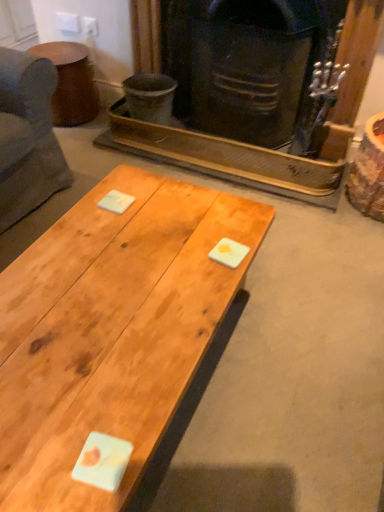
Question: Is natural wood coffee table at center positioned before brown matte side table at upper left?

Choices:
 (A) no
 (B) yes

Answer: (B)

Question: Considering the relative sizes of natural wood coffee table at center and brown matte side table at upper left in the image provided, is natural wood coffee table at center thinner than brown matte side table at upper left?

Choices:
 (A) yes
 (B) no

Answer: (B)

Question: Does natural wood coffee table at center have a greater width compared to brown matte side table at upper left?

Choices:
 (A) no
 (B) yes

Answer: (B)

Question: From a real-world perspective, is natural wood coffee table at center located beneath brown matte side table at upper left?

Choices:
 (A) yes
 (B) no

Answer: (B)

Question: Is natural wood coffee table at center far away from brown matte side table at upper left?

Choices:
 (A) yes
 (B) no

Answer: (A)

Question: Is point (66, 53) positioned closer to the camera than point (162, 129)?

Choices:
 (A) closer
 (B) farther

Answer: (B)

Question: From a real-world perspective, is brown matte side table at upper left physically located above or below dark brown wood fireplace at center?

Choices:
 (A) above
 (B) below

Answer: (B)

Question: Is brown matte side table at upper left spatially inside dark brown wood fireplace at center, or outside of it?

Choices:
 (A) outside
 (B) inside

Answer: (A)

Question: Is brown matte side table at upper left bigger or smaller than dark brown wood fireplace at center?

Choices:
 (A) small
 (B) big

Answer: (A)

Question: From the image's perspective, is dark brown wood fireplace at center above or below brown matte side table at upper left?

Choices:
 (A) below
 (B) above

Answer: (A)

Question: Is dark brown wood fireplace at center situated inside brown matte side table at upper left or outside?

Choices:
 (A) inside
 (B) outside

Answer: (B)

Question: Visually, is dark brown wood fireplace at center positioned to the left or to the right of brown matte side table at upper left?

Choices:
 (A) left
 (B) right

Answer: (B)

Question: Considering the positions of point (137, 41) and point (74, 90), is point (137, 41) closer or farther from the camera than point (74, 90)?

Choices:
 (A) closer
 (B) farther

Answer: (A)

Question: Considering the positions of brown matte side table at upper left and natural wood coffee table at center in the image, is brown matte side table at upper left bigger or smaller than natural wood coffee table at center?

Choices:
 (A) small
 (B) big

Answer: (A)

Question: In terms of height, does brown matte side table at upper left look taller or shorter compared to natural wood coffee table at center?

Choices:
 (A) short
 (B) tall

Answer: (A)